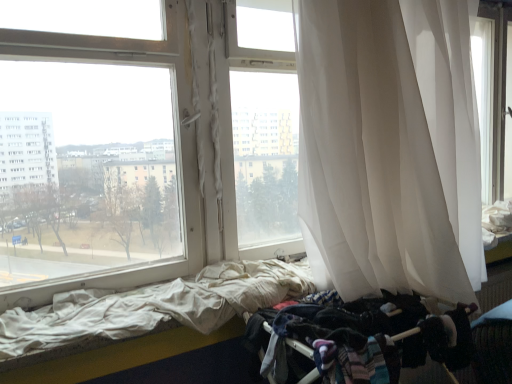
What is the approximate height of white fabric bed at lower left?

white fabric bed at lower left is 2.44 inches tall.

Find the location of a particular element. white sheer curtain at right is located at coordinates (389, 147).

Considering the positions of points (471, 342) and (100, 368), is point (471, 342) farther from camera compared to point (100, 368)?

Yes, it is.

Would you say white fabric bed at lower left is part of dark fabric baby carriage at lower right's contents?

That's incorrect, white fabric bed at lower left is not inside dark fabric baby carriage at lower right.

Does dark fabric baby carriage at lower right have a greater width compared to white fabric bed at lower left?

Yes.

Is dark fabric baby carriage at lower right taller or shorter than white fabric bed at lower left?

In the image, dark fabric baby carriage at lower right appears to be taller than white fabric bed at lower left.

Which of these two, dark fabric baby carriage at lower right or white sheer curtain at right, is smaller?

dark fabric baby carriage at lower right is smaller.

From the image's perspective, which one is positioned higher, dark fabric baby carriage at lower right or white sheer curtain at right?

white sheer curtain at right appears higher in the image.

How far apart are dark fabric baby carriage at lower right and white sheer curtain at right?

dark fabric baby carriage at lower right and white sheer curtain at right are 14.00 inches apart.

Which object is positioned more to the right, dark fabric baby carriage at lower right or white sheer curtain at right?

From the viewer's perspective, white sheer curtain at right appears more on the right side.

From the image's perspective, is white sheer curtain at right under white fabric bed at lower left?

No.

Is white sheer curtain at right aimed at white fabric bed at lower left?

No.

Looking at this image, measure the distance from white sheer curtain at right to white fabric bed at lower left.

A distance of 28.59 inches exists between white sheer curtain at right and white fabric bed at lower left.

Is white sheer curtain at right surrounding white fabric bed at lower left?

No, white fabric bed at lower left is not inside white sheer curtain at right.

Identify the location of curtain above the dark fabric baby carriage at lower right (from the image's perspective). This screenshot has width=512, height=384. (389, 147).

Is point (414, 163) behind point (459, 320)?

Yes, it is.

From a real-world perspective, is white sheer curtain at right physically located above or below dark fabric baby carriage at lower right?

Clearly, from a real-world perspective, white sheer curtain at right is above dark fabric baby carriage at lower right.

Can you confirm if white fabric bed at lower left is smaller than white sheer curtain at right?

Yes, white fabric bed at lower left is smaller than white sheer curtain at right.

Considering the relative sizes of white fabric bed at lower left and white sheer curtain at right in the image provided, is white fabric bed at lower left taller than white sheer curtain at right?

No.

From the image's perspective, is white fabric bed at lower left over white sheer curtain at right?

No, from the image's perspective, white fabric bed at lower left is not above white sheer curtain at right.

Is the depth of white fabric bed at lower left greater than that of white sheer curtain at right?

Yes, the depth of white fabric bed at lower left is greater than that of white sheer curtain at right.

From the image's perspective, is white fabric bed at lower left beneath dark fabric baby carriage at lower right?

Incorrect, from the image's perspective, white fabric bed at lower left is higher than dark fabric baby carriage at lower right.

Would you say white fabric bed at lower left is inside or outside dark fabric baby carriage at lower right?

white fabric bed at lower left lies outside dark fabric baby carriage at lower right.

Can you confirm if white fabric bed at lower left is smaller than dark fabric baby carriage at lower right?

Yes.

Where is `baby carriage lying below the white fabric bed at lower left (from the image's perspective)`? This screenshot has height=384, width=512. baby carriage lying below the white fabric bed at lower left (from the image's perspective) is located at coordinates (362, 338).

The width and height of the screenshot is (512, 384). I want to click on curtain in front of the dark fabric baby carriage at lower right, so (x=389, y=147).

From the image, which object appears to be nearer to dark fabric baby carriage at lower right, white sheer curtain at right or white fabric bed at lower left?

white sheer curtain at right.

Looking at the image, which one is located further to dark fabric baby carriage at lower right, white fabric bed at lower left or white sheer curtain at right?

white fabric bed at lower left.

Based on their spatial positions, is white sheer curtain at right or dark fabric baby carriage at lower right further from white fabric bed at lower left?

Among the two, white sheer curtain at right is located further to white fabric bed at lower left.

Considering their positions, is white fabric bed at lower left positioned further to white sheer curtain at right than dark fabric baby carriage at lower right?

Based on the image, white fabric bed at lower left appears to be further to white sheer curtain at right.

When comparing their distances from white fabric bed at lower left, does dark fabric baby carriage at lower right or white sheer curtain at right seem closer?

Among the two, dark fabric baby carriage at lower right is located nearer to white fabric bed at lower left.

Estimate the real-world distances between objects in this image. Which object is closer to white sheer curtain at right, dark fabric baby carriage at lower right or white fabric bed at lower left?

dark fabric baby carriage at lower right is closer to white sheer curtain at right.

You are a GUI agent. You are given a task and a screenshot of the screen. Output one action in this format:
    pyautogui.click(x=<x>, y=<y>)
    Task: Click on the bed between white sheer curtain at right and dark fabric baby carriage at lower right in the up-down direction
    Image resolution: width=512 pixels, height=384 pixels.
    Given the screenshot: What is the action you would take?
    pyautogui.click(x=143, y=360)